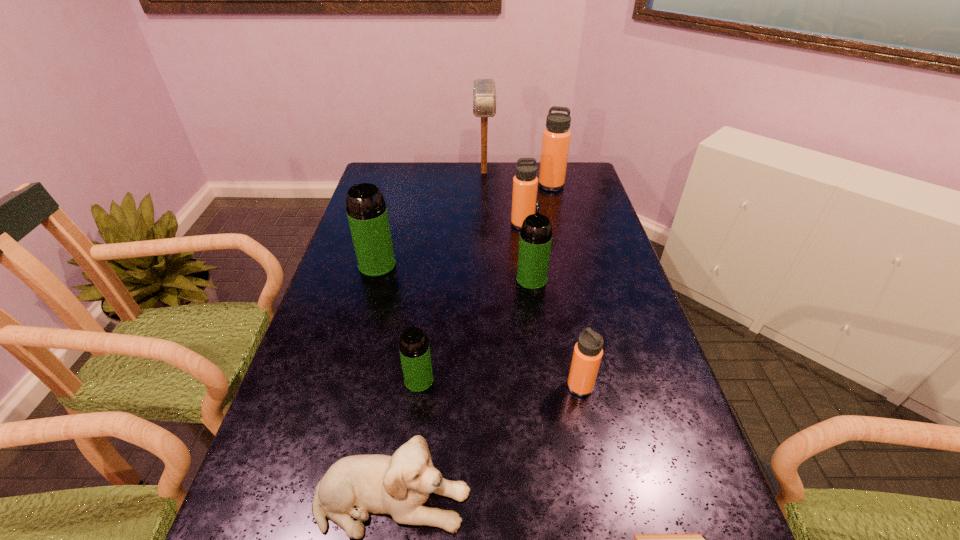
You are a GUI agent. You are given a task and a screenshot of the screen. Output one action in this format:
    pyautogui.click(x=<x>, y=<y>)
    Task: Click on the smallest orange thermos bottle
    The width and height of the screenshot is (960, 540).
    Given the screenshot: What is the action you would take?
    pyautogui.click(x=587, y=355)

Identify the location of free space located on the striking face of the mallet. This screenshot has width=960, height=540. (485, 218).

Where is `free space located 0.260m from the spout of the leftmost green thermos bottle`? free space located 0.260m from the spout of the leftmost green thermos bottle is located at coordinates (355, 346).

You are a GUI agent. You are given a task and a screenshot of the screen. Output one action in this format:
    pyautogui.click(x=<x>, y=<y>)
    Task: Click on the vacant space located 0.150m on the left of the biggest orange thermos bottle
    
    Given the screenshot: What is the action you would take?
    pyautogui.click(x=499, y=186)

This screenshot has height=540, width=960. What are the coordinates of `free space located 0.380m from the spout of the second smallest green thermos bottle` in the screenshot? It's located at (521, 202).

Where is `free region located 0.120m from the spout of the second smallest green thermos bottle`? free region located 0.120m from the spout of the second smallest green thermos bottle is located at coordinates (527, 245).

Find the location of a particular element. This screenshot has height=540, width=960. blank space located from the spout of the second smallest green thermos bottle is located at coordinates (525, 231).

Find the location of `vacant area situated 0.320m on the left of the seventh nearest object`. vacant area situated 0.320m on the left of the seventh nearest object is located at coordinates (417, 224).

Identify the location of vacant region located 0.150m from the spout of the second thermos bottle from left to right. The width and height of the screenshot is (960, 540). (409, 456).

Image resolution: width=960 pixels, height=540 pixels. In order to click on free space located 0.080m on the back of the nearest orange thermos bottle in this screenshot , I will do `click(572, 349)`.